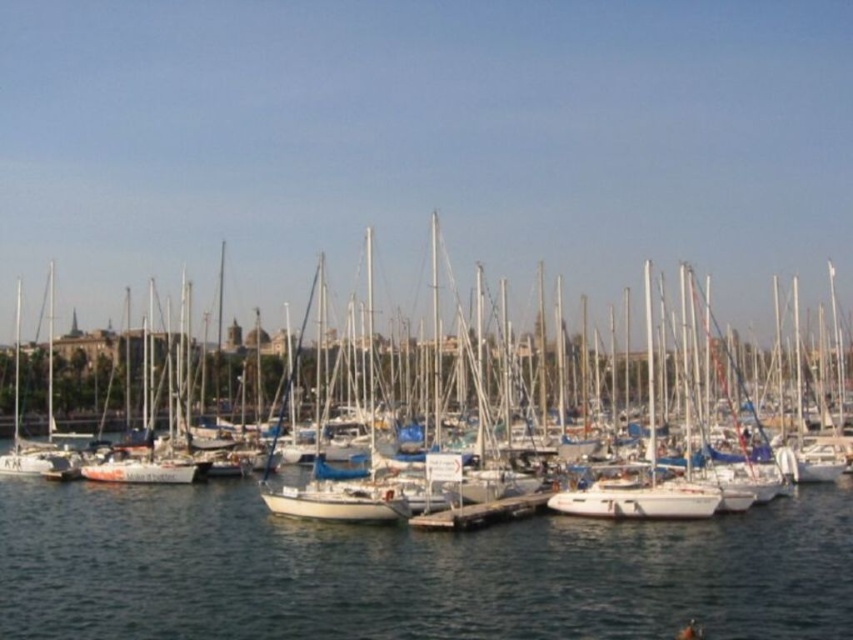
Looking at this image, you are standing at the edge of the marina and notice a point marked at coordinates point (408, 572). Based on the scene description, can you determine what surface this point is located on?

The point (408, 572) is on clear water at center, so it is located on the water surface in the marina.

You are a sailor trying to navigate your boat to the smooth concrete dock at center. From your current position at the edge of the marina, which direction should you steer your boat to reach the dock? Use the clear water at center as a reference point.

The clear water at center is to the left of the smooth concrete dock at center, so you should steer your boat to the right to reach the dock.